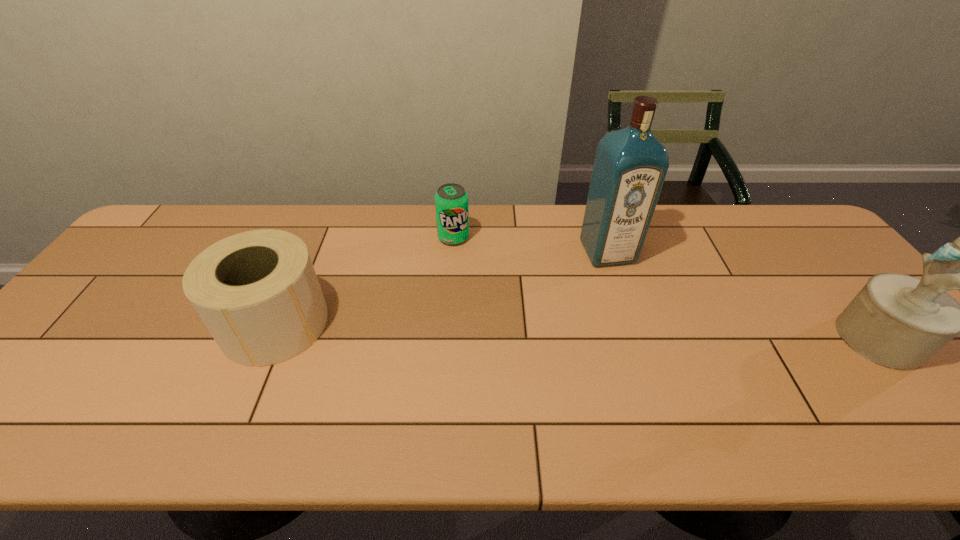
The width and height of the screenshot is (960, 540). Identify the location of object at the right edge. (897, 321).

Identify the location of vacant space at the far edge of the desktop. The height and width of the screenshot is (540, 960). (695, 204).

The image size is (960, 540). In the image, there is a desktop. Identify the location of free space at the near edge. pos(619,406).

Where is `vacant space at the far left corner of the desktop`? vacant space at the far left corner of the desktop is located at coordinates (199, 211).

Where is `free point at the far right corner`? The height and width of the screenshot is (540, 960). free point at the far right corner is located at coordinates (795, 249).

You are a GUI agent. You are given a task and a screenshot of the screen. Output one action in this format:
    pyautogui.click(x=<x>, y=<y>)
    Task: Click on the free spot between the pop soda and the tallest object
    
    Given the screenshot: What is the action you would take?
    pyautogui.click(x=531, y=245)

This screenshot has height=540, width=960. I want to click on vacant space that is in between the pop soda and the third shortest object, so click(667, 288).

You are a GUI agent. You are given a task and a screenshot of the screen. Output one action in this format:
    pyautogui.click(x=<x>, y=<y>)
    Task: Click on the vacant area that lies between the third shortest object and the pop soda
    The width and height of the screenshot is (960, 540).
    Given the screenshot: What is the action you would take?
    pyautogui.click(x=667, y=288)

Identify the location of vacant area between the figurine and the leftmost object. (578, 331).

Where is `free space between the figurine and the liquor`? This screenshot has width=960, height=540. free space between the figurine and the liquor is located at coordinates (744, 295).